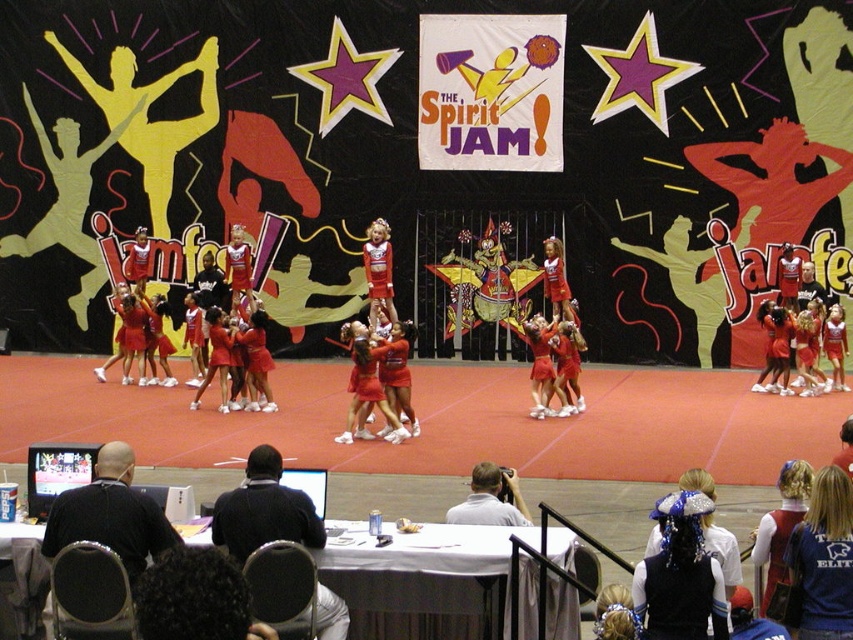
Describe the element at coordinates (109, 515) in the screenshot. The height and width of the screenshot is (640, 853). I see `black shirt at center` at that location.

Who is positioned more to the right, black shirt at center or gray fabric camera at center?

From the viewer's perspective, gray fabric camera at center appears more on the right side.

Describe the element at coordinates (109, 515) in the screenshot. The image size is (853, 640). I see `black shirt at center` at that location.

Locate an element on the screen. black shirt at center is located at coordinates (x=109, y=515).

From the picture: Can you confirm if blue jersey at center is positioned to the right of gray fabric camera at center?

Yes, blue jersey at center is to the right of gray fabric camera at center.

Is blue jersey at center further to the viewer compared to gray fabric camera at center?

That is False.

Which is behind, point (796, 632) or point (518, 515)?

Positioned behind is point (518, 515).

You are a GUI agent. You are given a task and a screenshot of the screen. Output one action in this format:
    pyautogui.click(x=<x>, y=<y>)
    Task: Click on the blue jersey at center
    This screenshot has width=853, height=640.
    Given the screenshot: What is the action you would take?
    pyautogui.click(x=822, y=561)

What do you see at coordinates (490, 499) in the screenshot?
I see `gray fabric camera at center` at bounding box center [490, 499].

Which of these two, gray fabric camera at center or matte red cheerleader at center, stands shorter?

With less height is gray fabric camera at center.

This screenshot has width=853, height=640. I want to click on gray fabric camera at center, so click(490, 499).